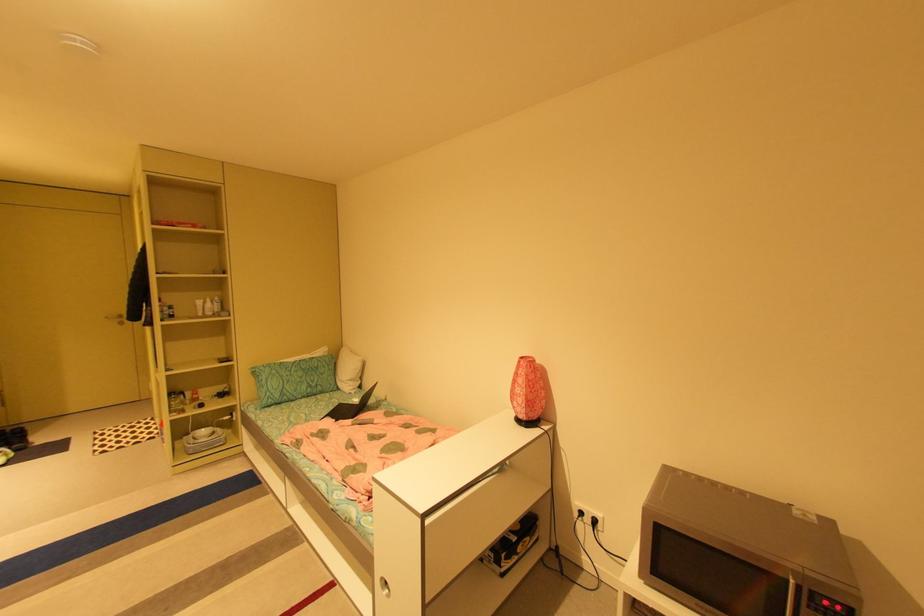
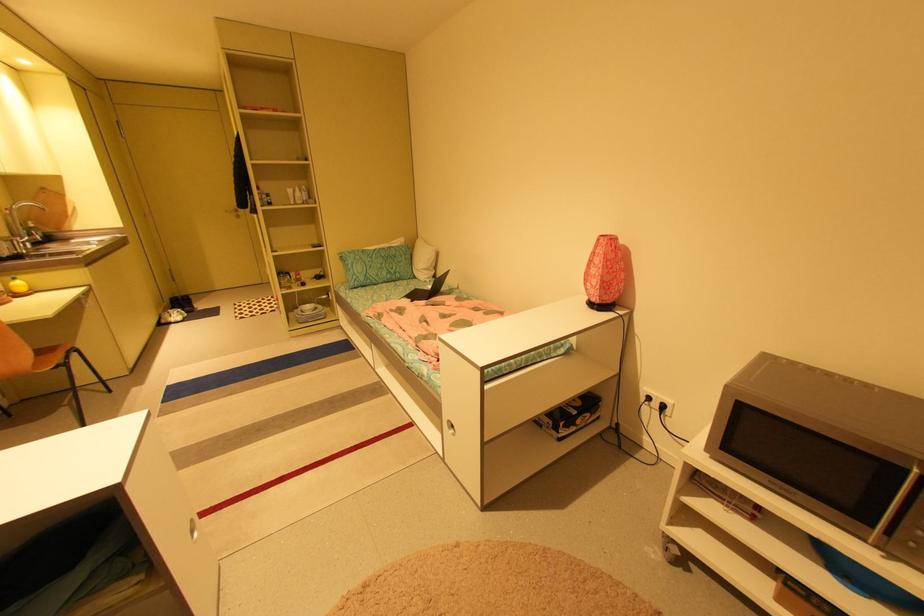
In the second image, find the point that corresponds to point 528,358 in the first image.

(608, 236)